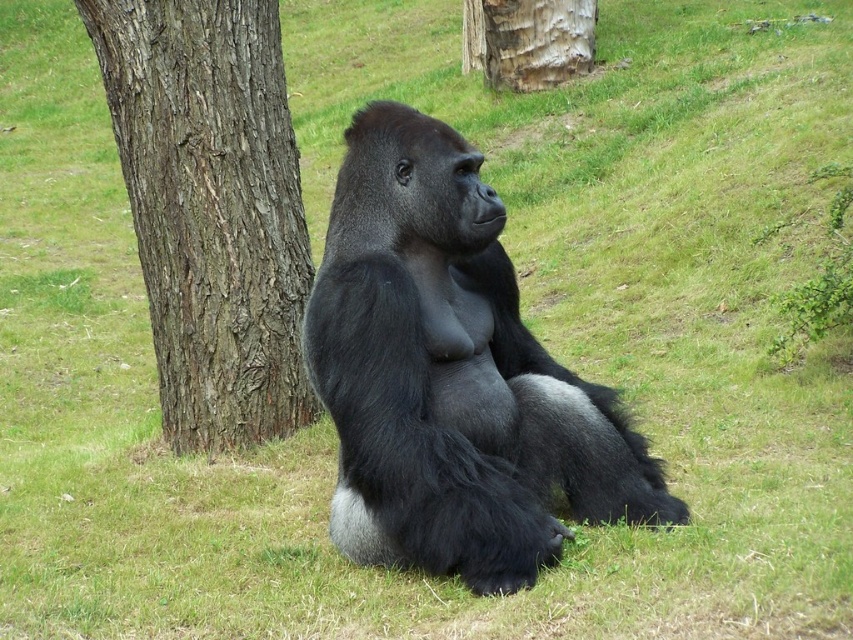
Question: Which of the following is the farthest from the observer?

Choices:
 (A) gray textured bark at center
 (B) brown rough bark tree at left

Answer: (A)

Question: Is shiny black fur at center to the right of brown rough bark tree at left from the viewer's perspective?

Choices:
 (A) no
 (B) yes

Answer: (B)

Question: From the image, what is the correct spatial relationship of shiny black fur at center in relation to brown rough bark tree at left?

Choices:
 (A) above
 (B) below

Answer: (B)

Question: Which of the following is the farthest from the observer?

Choices:
 (A) brown rough bark tree at left
 (B) gray textured bark at center
 (C) shiny black fur at center

Answer: (B)

Question: Considering the real-world distances, which object is closest to the gray textured bark at center?

Choices:
 (A) brown rough bark tree at left
 (B) shiny black fur at center

Answer: (A)

Question: Can you confirm if brown rough bark tree at left is positioned below gray textured bark at center?

Choices:
 (A) no
 (B) yes

Answer: (B)